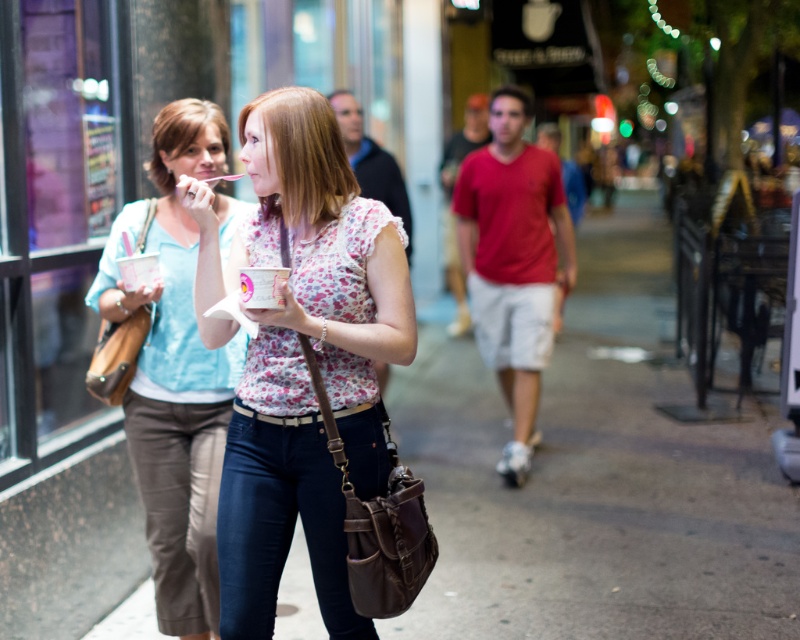
You are a photographer standing in the urban street scene at night. You want to take a closeup photo of the matte pink ice cream cup at center. Considering your current position, can you estimate how far you need to move forward to get the cup within the camera frame?

The matte pink ice cream cup at center is 3.72 meters from viewer. To capture it in a closeup, you would need to move forward approximately 3.72 meters to reduce the distance between the camera and the cup.

You are a delivery robot that needs to place both the matte brown bag at center and the matte pink ice cream cup at center into a storage compartment. The compartment has a height limit of 15 cm. Which item might exceed the height limit?

The matte brown bag at center has a greater height compared to the matte pink ice cream cup at center, so the matte brown bag at center might exceed the height limit of 15 cm.